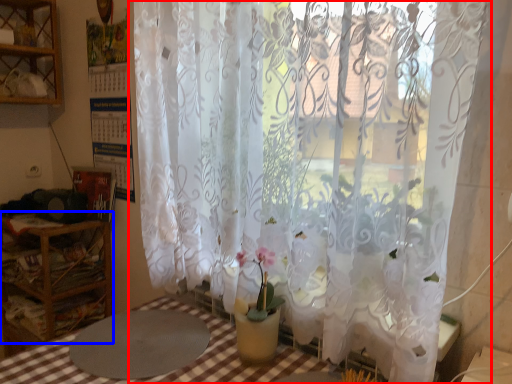
Question: Which of the following is the closest to the observer, curtain (highlighted by a red box) or furniture (highlighted by a blue box)?

Choices:
 (A) curtain
 (B) furniture

Answer: (A)